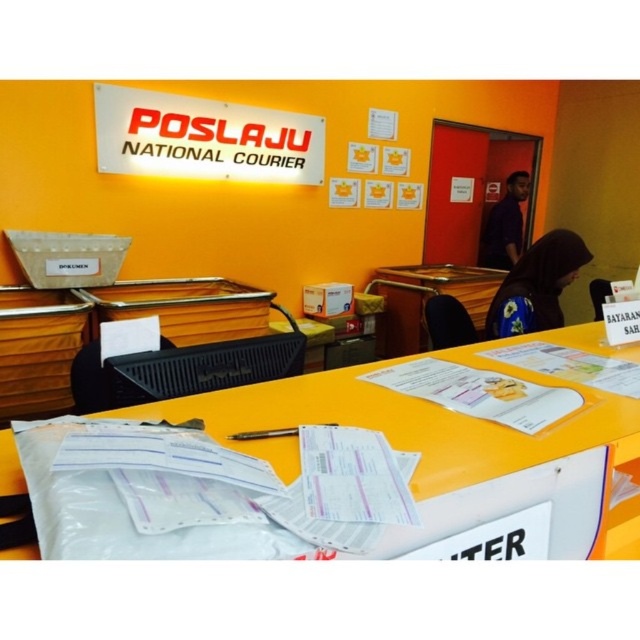
From the picture: You are a customer at the Poslaju National Courier facility and need to place a package on the counter. Which table should you use, the yellow plastic table at center or the orange matte table at center?

The yellow plastic table at center is positioned over the orange matte table at center, so you should place the package on the yellow plastic table at center as it is the visible one on top.

You are standing at the entrance of the Poslaju National Courier facility and want to approach the counter to fill out a form. Based on the image provided, where should you head to locate the yellow plastic table at center?

The yellow plastic table at center is located at the coordinates point (426,300) in the image, so you should head towards the center area to find it.